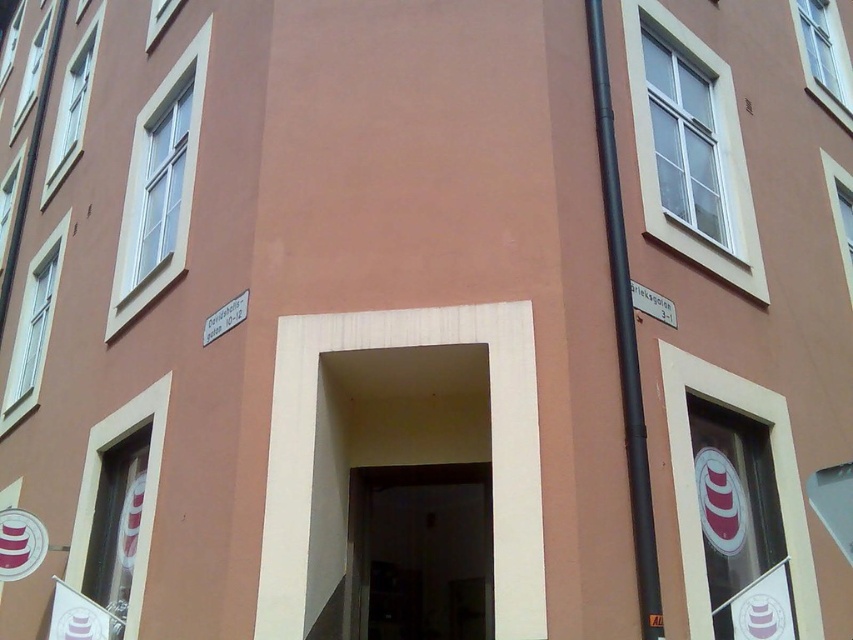
You are a delivery person trying to navigate through the area. You see the black matte pipe at right and the white plastic street sign at upper right. Which object is wider?

The white plastic street sign at upper right is wider than the black matte pipe at right.

You are standing in front of the building and notice two points marked on the wall. Which point, point (x=624, y=412) or point (x=668, y=301), is closer to you?

Point (x=624, y=412) is closer to the viewer than point (x=668, y=301).